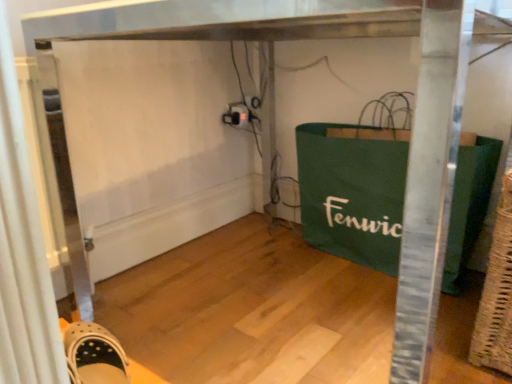
Where is `space that is in front of green paper bag at center`? The image size is (512, 384). space that is in front of green paper bag at center is located at coordinates (365, 327).